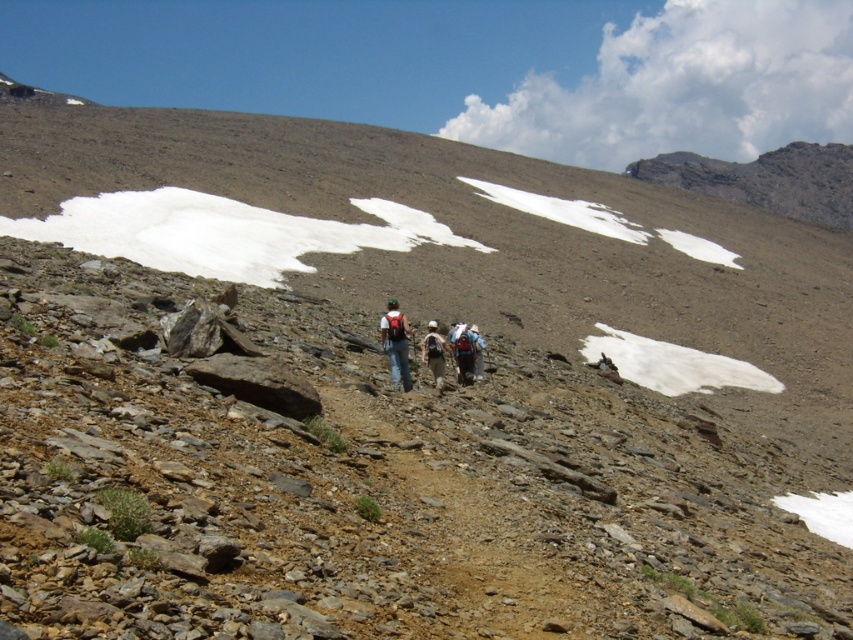
Question: Observing the image, what is the correct spatial positioning of matte blue jeans at center in reference to matte white backpack at center?

Choices:
 (A) above
 (B) below

Answer: (A)

Question: Which object is the closest to the blue fabric backpack at center?

Choices:
 (A) matte blue jeans at center
 (B) matte white backpack at center

Answer: (B)

Question: Does blue fabric backpack at center have a larger size compared to matte white backpack at center?

Choices:
 (A) no
 (B) yes

Answer: (A)

Question: Among these points, which one is nearest to the camera?

Choices:
 (A) (427, 333)
 (B) (474, 356)
 (C) (399, 385)

Answer: (C)

Question: Which object is closer to the camera taking this photo?

Choices:
 (A) blue fabric backpack at center
 (B) matte blue jeans at center
 (C) matte white backpack at center
 (D) matte gray backpack at center

Answer: (B)

Question: Can you confirm if matte blue jeans at center is positioned to the right of matte white backpack at center?

Choices:
 (A) no
 (B) yes

Answer: (A)